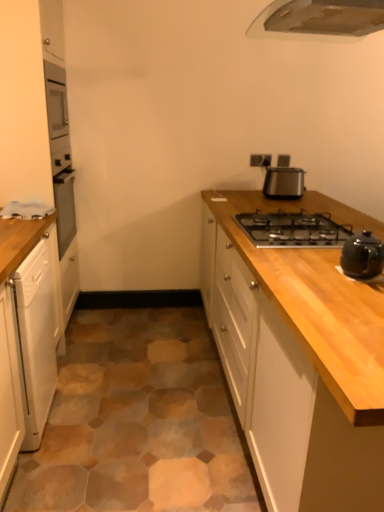
The image size is (384, 512). I want to click on space that is in front of metallic stainless steel toaster at upper right, which is counted as the 2th kitchen appliance, starting from the front, so click(x=303, y=201).